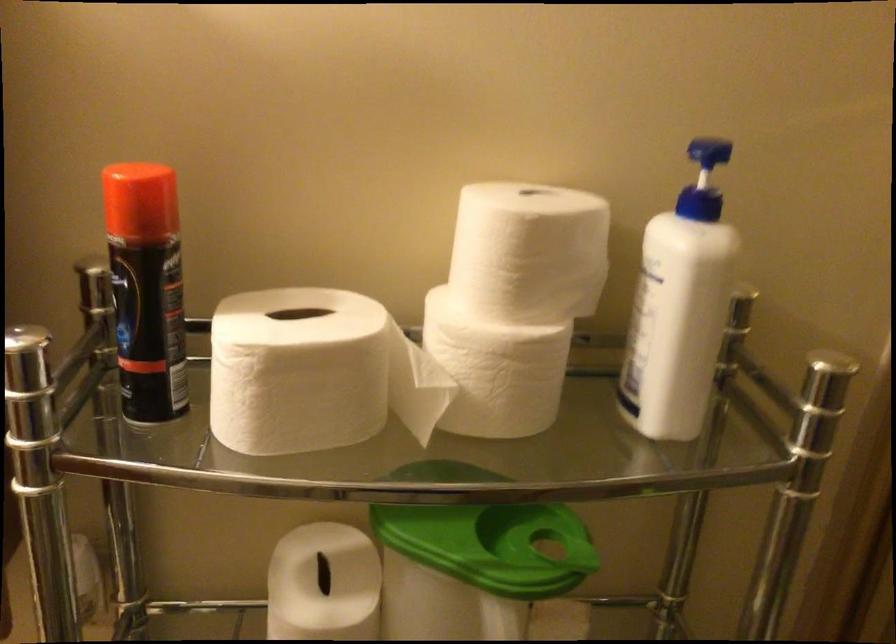
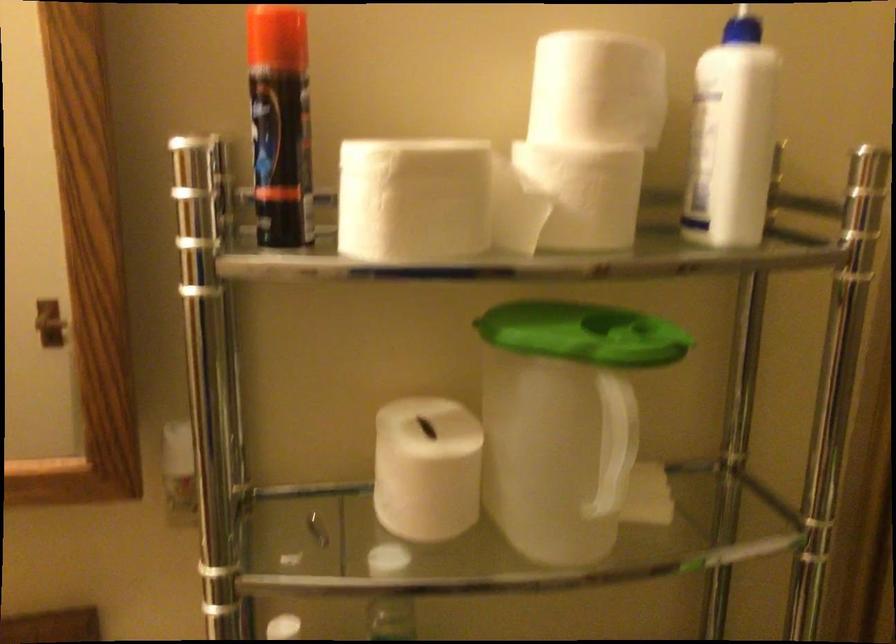
The point at (282, 383) is marked in the first image. Where is the corresponding point in the second image?

(412, 200)